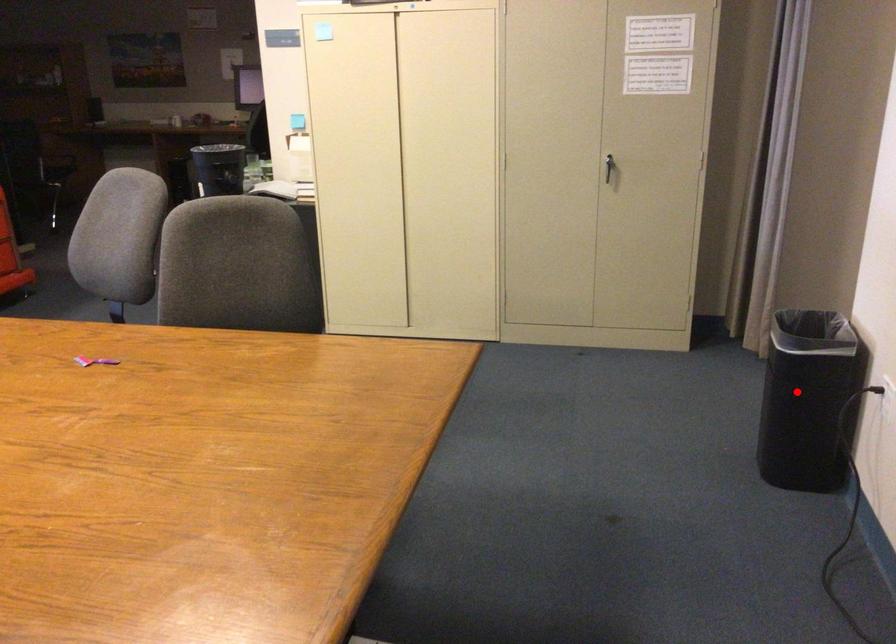
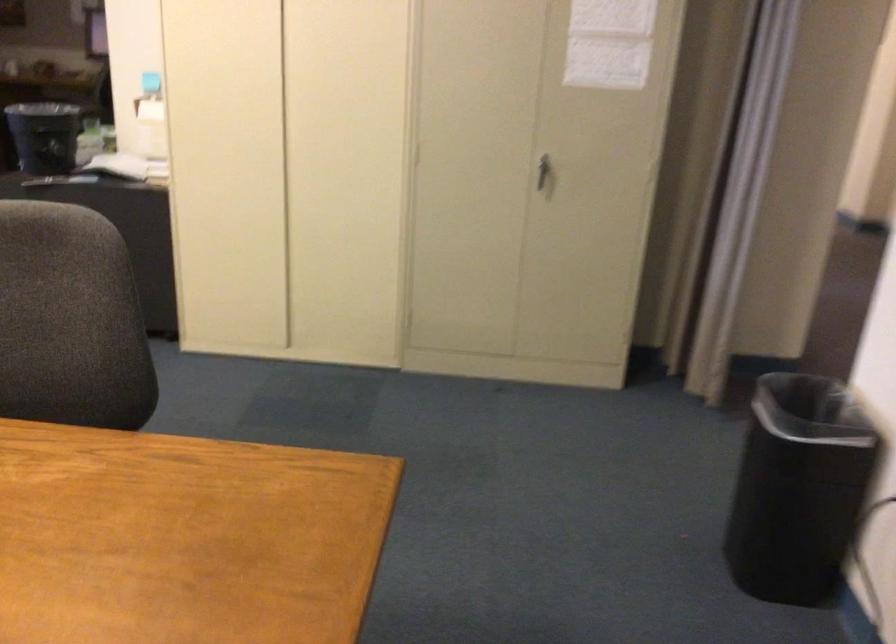
Question: I am providing you with two images of the same scene from different viewpoints. A red point is shown in image1. For the corresponding object point in image2, is it positioned nearer or farther from the camera?

Choices:
 (A) Nearer
 (B) Farther

Answer: (A)